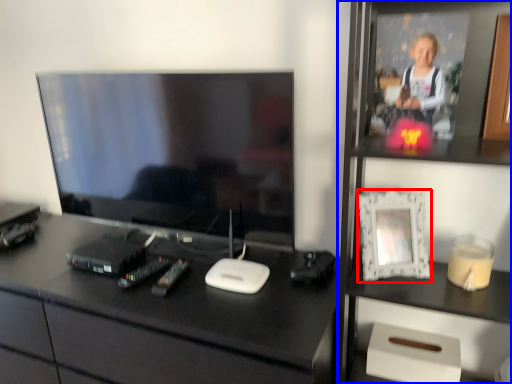
Question: Which object is closer to the camera taking this photo, picture frame (highlighted by a red box) or bookshelf (highlighted by a blue box)?

Choices:
 (A) picture frame
 (B) bookshelf

Answer: (B)